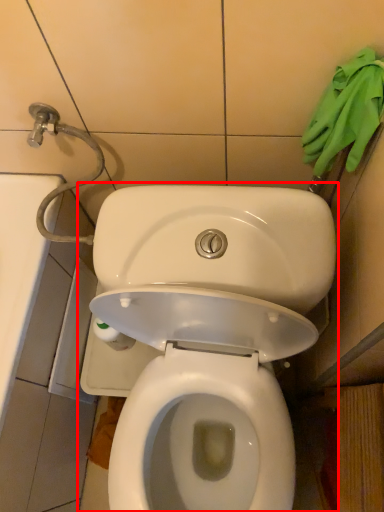
Question: Considering the relative positions of toilet (annotated by the red box) and material in the image provided, where is toilet (annotated by the red box) located with respect to the staircase?

Choices:
 (A) left
 (B) right

Answer: (A)